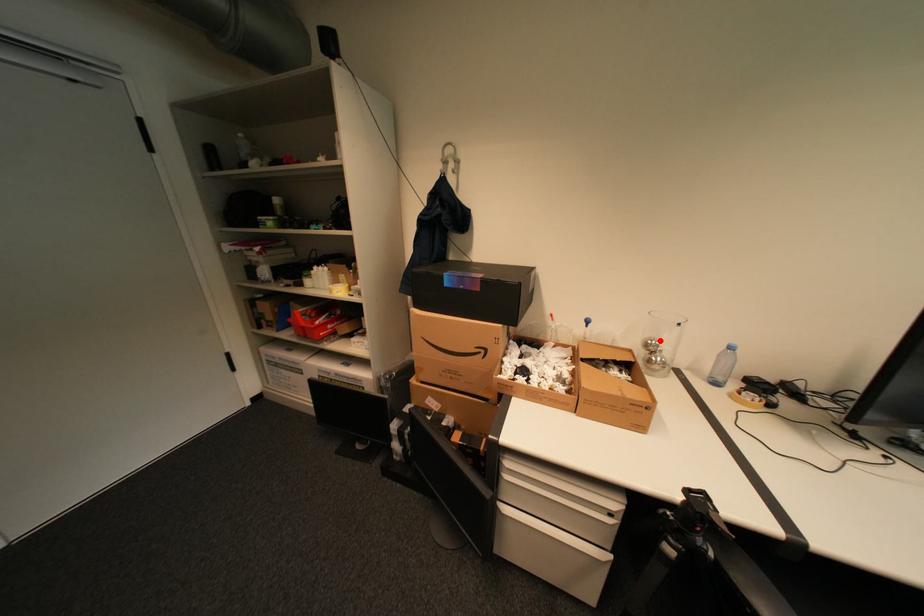
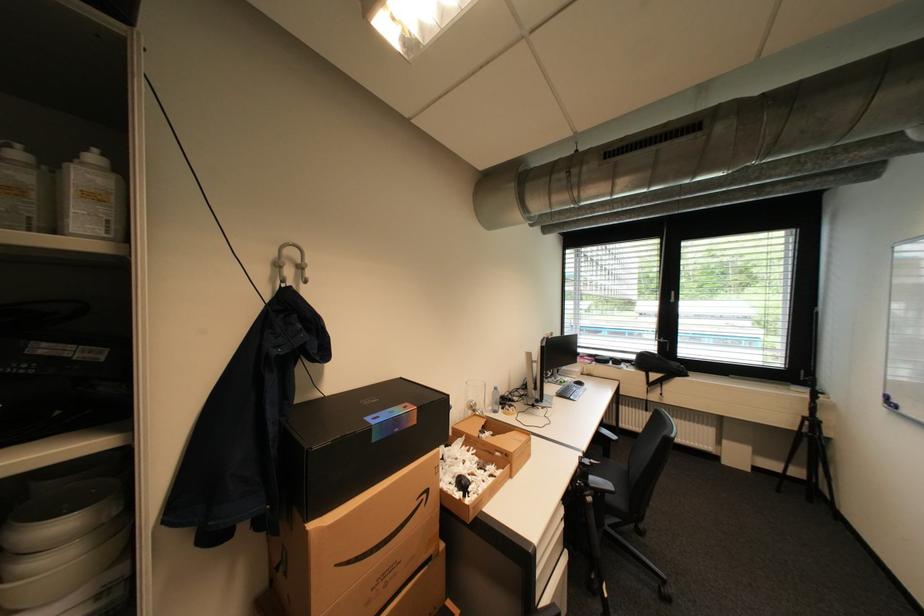
Locate, in the second image, the point that corresponds to the highlighted location in the first image.

(480, 402)